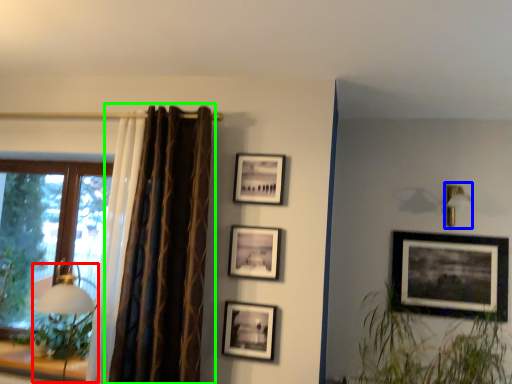
Question: Which object is positioned farthest from table lamp (highlighted by a red box)? Select from lamp (highlighted by a blue box) and curtain (highlighted by a green box).

Choices:
 (A) lamp
 (B) curtain

Answer: (A)